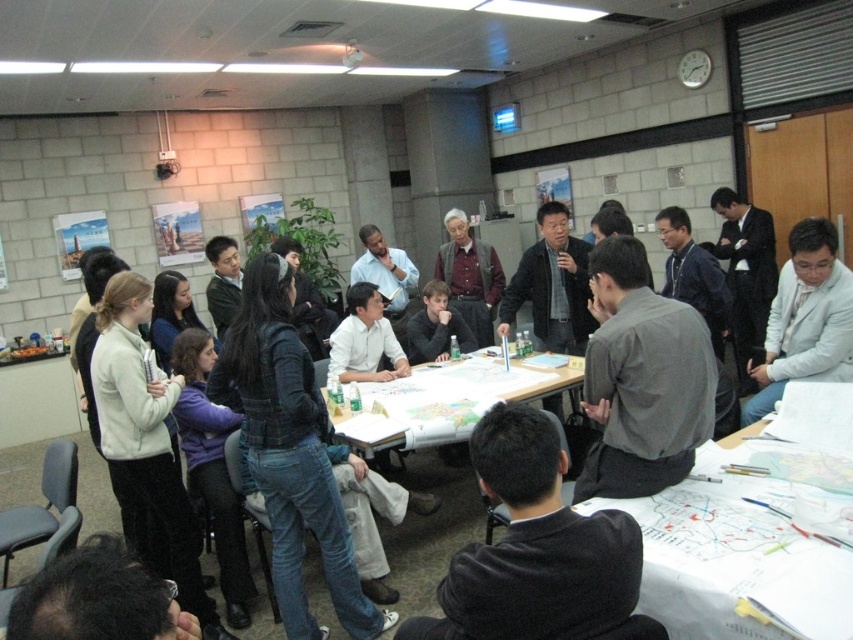
You are a photographer trying to capture a candid shot of the meeting. You notice the white fleece jacket at upper left and the matte black shirt at center. Which clothing item should you focus on to ensure it appears larger in your photo without moving your position?

The white fleece jacket at upper left is much taller than the matte black shirt at center, so focusing on the white fleece jacket at upper left will make it appear larger in the photo without changing your position.

Where is the white fleece jacket at upper left located in the image?

The white fleece jacket at upper left is located at the 2D coordinates of point 0.700 in the x axis and 0.171 in the y axis.

You are a participant in the meeting and need to place a small sticky note on the white paper at center. Considering the height of the gray matte shirt at center, will the sticky note be visible from above the shirt?

The white paper at center is not as tall as the gray matte shirt at center, meaning the paper is shorter. Therefore, placing a sticky note on the white paper at center might be obscured by the shirt if the shirt is positioned above or in front of it, making visibility uncertain without knowing exact placement.